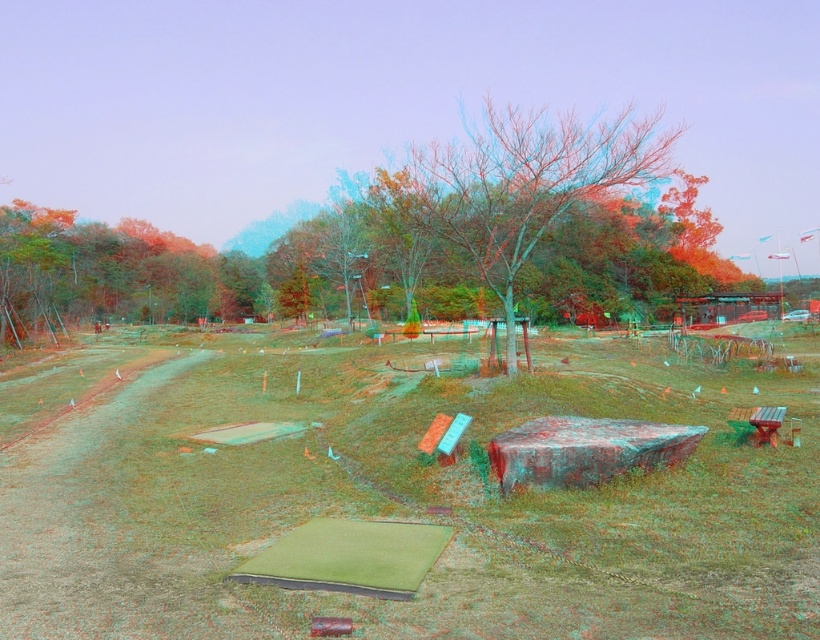
Question: Which object appears farthest from the camera in this image?

Choices:
 (A) wooden bench at lower right
 (B) green grass at center
 (C) bare wood tree at center

Answer: (C)

Question: Which point is farther to the camera?

Choices:
 (A) green grass at center
 (B) bare wood tree at center
 (C) wooden bench at lower right

Answer: (B)

Question: Does bare wood tree at center have a smaller size compared to wooden bench at lower right?

Choices:
 (A) no
 (B) yes

Answer: (A)

Question: Which object is positioned farthest from the wooden bench at lower right?

Choices:
 (A) green grass at center
 (B) bare wood tree at center

Answer: (B)

Question: Is bare wood tree at center thinner than wooden bench at lower right?

Choices:
 (A) no
 (B) yes

Answer: (A)

Question: Does green grass at center have a greater width compared to bare wood tree at center?

Choices:
 (A) yes
 (B) no

Answer: (A)